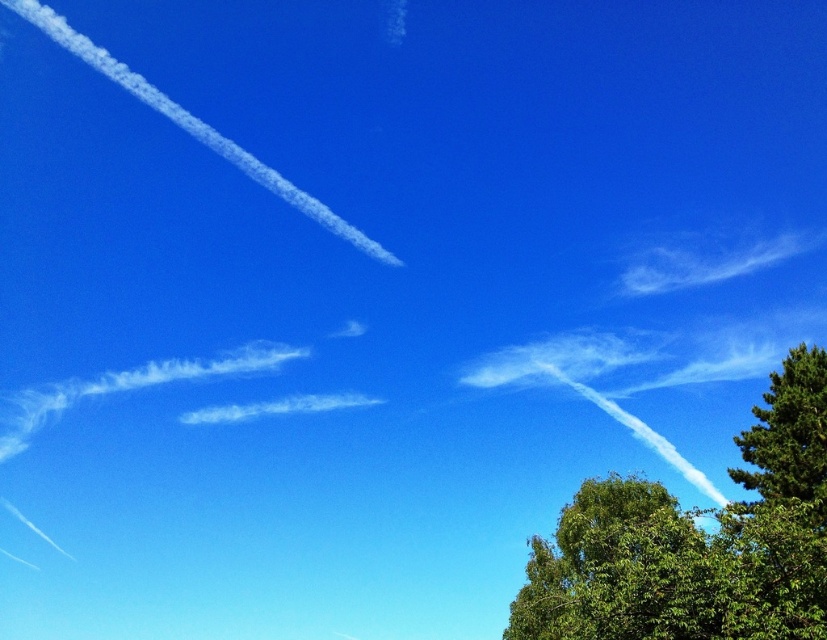
Question: Can you confirm if green leafy tree at right is positioned above green leafy tree at lower right?

Choices:
 (A) no
 (B) yes

Answer: (B)

Question: Which object is closer to the camera taking this photo?

Choices:
 (A) green leafy tree at right
 (B) green leafy tree at lower right

Answer: (A)

Question: Which point is closer to the camera taking this photo?

Choices:
 (A) (622, 506)
 (B) (555, 630)

Answer: (B)

Question: Can you confirm if green leafy tree at right is positioned above green leafy tree at lower right?

Choices:
 (A) yes
 (B) no

Answer: (A)

Question: Does green leafy tree at right appear on the right side of green leafy tree at lower right?

Choices:
 (A) no
 (B) yes

Answer: (B)